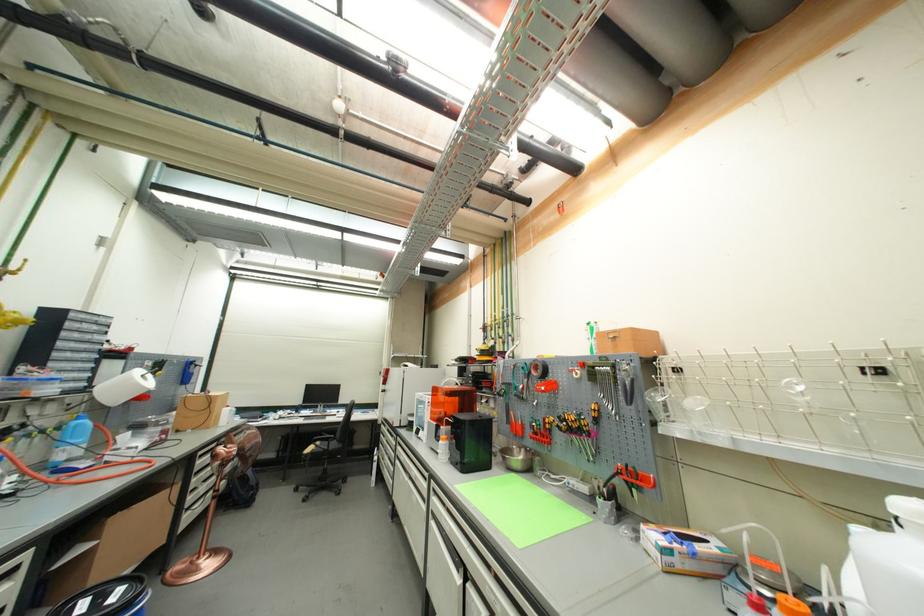
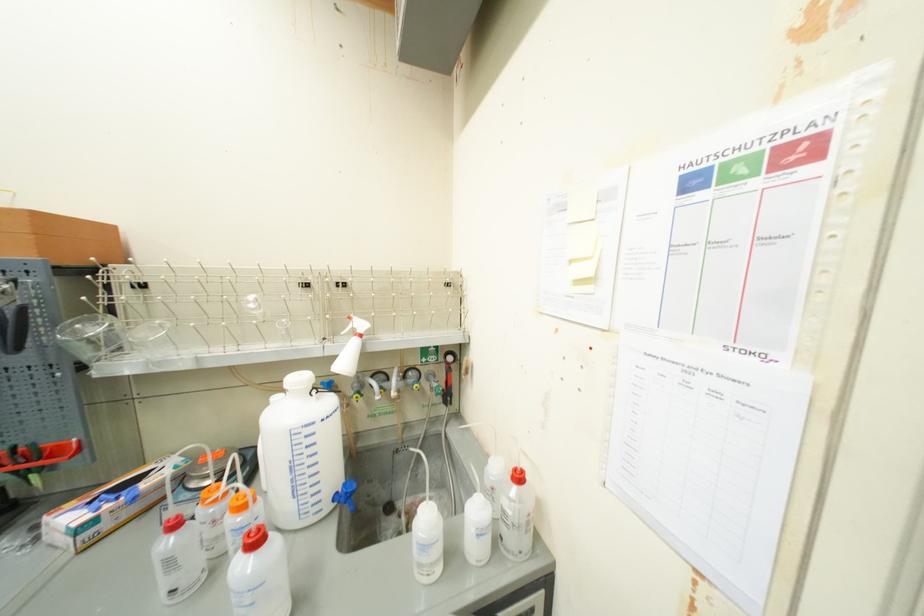
Find the pixel in the second image that matches (x=704, y=399) in the first image.

(163, 323)